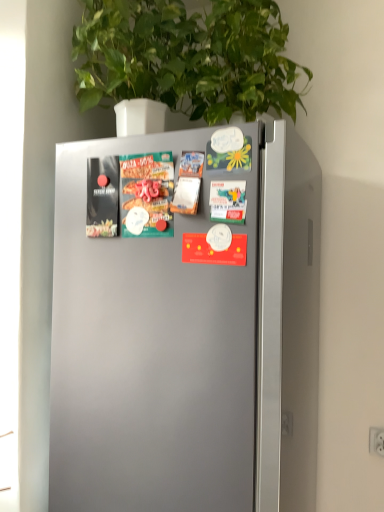
Question: Is point (228, 58) positioned closer to the camera than point (120, 232)?

Choices:
 (A) closer
 (B) farther

Answer: (B)

Question: From a real-world perspective, is green leafy plant at upper center above or below matte cardboard pizza box at center left?

Choices:
 (A) above
 (B) below

Answer: (A)

Question: Considering the relative positions of green leafy plant at upper center and matte cardboard pizza box at center left in the image provided, is green leafy plant at upper center to the left or to the right of matte cardboard pizza box at center left?

Choices:
 (A) left
 (B) right

Answer: (B)

Question: From a real-world perspective, is matte cardboard pizza box at center left above or below green leafy plant at upper center?

Choices:
 (A) below
 (B) above

Answer: (A)

Question: Is matte cardboard pizza box at center left wider or thinner than green leafy plant at upper center?

Choices:
 (A) wide
 (B) thin

Answer: (B)

Question: Considering the positions of matte cardboard pizza box at center left and green leafy plant at upper center in the image, is matte cardboard pizza box at center left bigger or smaller than green leafy plant at upper center?

Choices:
 (A) big
 (B) small

Answer: (B)

Question: From the image's perspective, is matte cardboard pizza box at center left positioned above or below green leafy plant at upper center?

Choices:
 (A) above
 (B) below

Answer: (B)